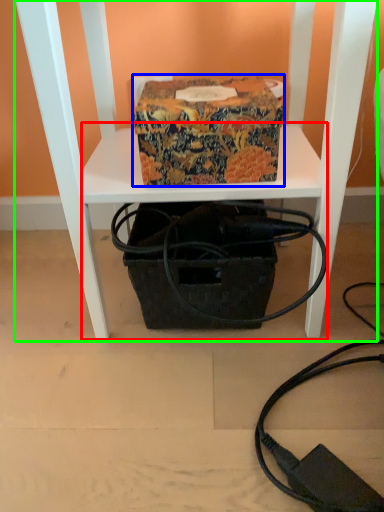
Question: Which is farther away from table (highlighted by a red box)? cardboard box (highlighted by a blue box) or furniture (highlighted by a green box)?

Choices:
 (A) cardboard box
 (B) furniture

Answer: (A)